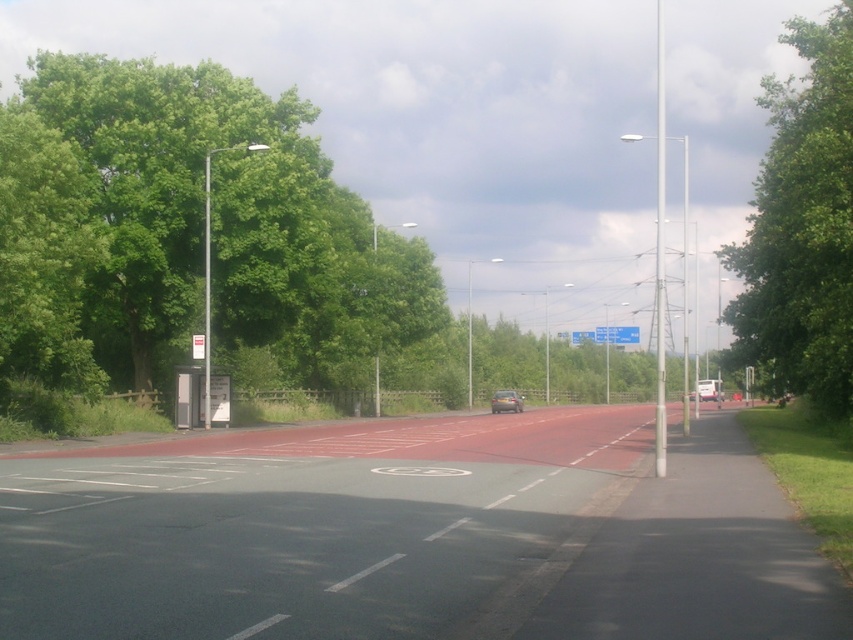
Question: Is blue plastic sign at center above matte silver car at center?

Choices:
 (A) yes
 (B) no

Answer: (A)

Question: Which of the following is the farthest from the observer?

Choices:
 (A) (596, 332)
 (B) (1, 115)
 (C) (793, 253)
 (D) (498, 404)

Answer: (A)

Question: In this image, where is green leafy tree at left located relative to green leafy tree at upper right?

Choices:
 (A) left
 (B) right

Answer: (A)

Question: Which object is farther from the camera taking this photo?

Choices:
 (A) blue plastic sign at center
 (B) green leafy tree at upper right
 (C) matte silver car at center

Answer: (A)

Question: Is green leafy tree at left below matte silver car at center?

Choices:
 (A) yes
 (B) no

Answer: (B)

Question: Estimate the real-world distances between objects in this image. Which object is closer to the blue plastic sign at center?

Choices:
 (A) green leafy tree at upper right
 (B) matte silver car at center

Answer: (B)